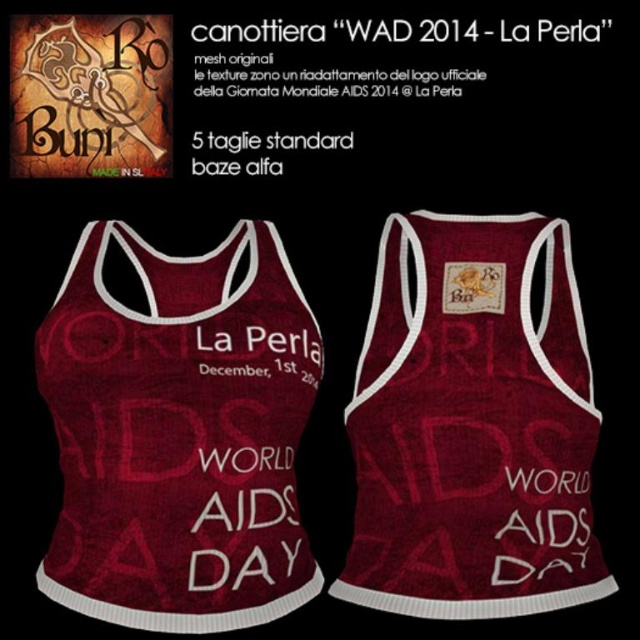
Question: Which point is farther from the camera taking this photo?

Choices:
 (A) (428, 272)
 (B) (52, 584)

Answer: (A)

Question: Can you confirm if burgundy textured tank top at center is positioned below matte maroon tank top at center?

Choices:
 (A) no
 (B) yes

Answer: (B)

Question: Does burgundy textured tank top at center come in front of matte maroon tank top at center?

Choices:
 (A) yes
 (B) no

Answer: (A)

Question: Is the position of burgundy knitted tank top at center less distant than that of matte maroon tank top at center?

Choices:
 (A) yes
 (B) no

Answer: (A)

Question: Among these objects, which one is farthest from the camera?

Choices:
 (A) burgundy textured tank top at center
 (B) matte maroon tank top at center

Answer: (B)

Question: Which object is farther from the camera taking this photo?

Choices:
 (A) burgundy knitted tank top at center
 (B) matte maroon tank top at center

Answer: (B)